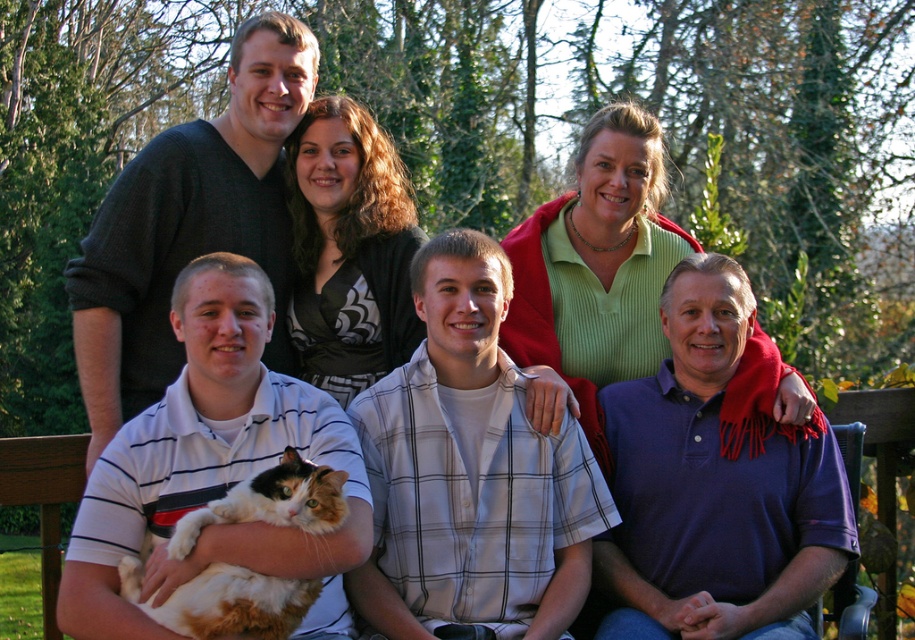
Question: Which object is closer to the camera taking this photo?

Choices:
 (A) calico fur cat at center
 (B) calico fur cat at lower left

Answer: (A)

Question: Does calico fur cat at lower left appear over calico fur cat at center?

Choices:
 (A) no
 (B) yes

Answer: (B)

Question: Does calico fur cat at lower left have a lesser width compared to calico fur cat at center?

Choices:
 (A) yes
 (B) no

Answer: (B)

Question: Where is calico fur cat at lower left located in relation to calico fur cat at center in the image?

Choices:
 (A) above
 (B) below

Answer: (A)